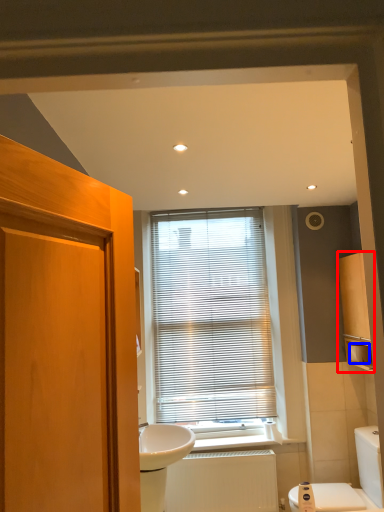
Question: Which object appears closest to the camera in this image, cabinetry (highlighted by a red box) or toilet paper (highlighted by a blue box)?

Choices:
 (A) cabinetry
 (B) toilet paper

Answer: (A)